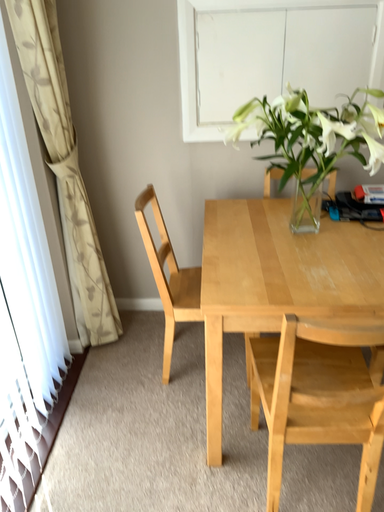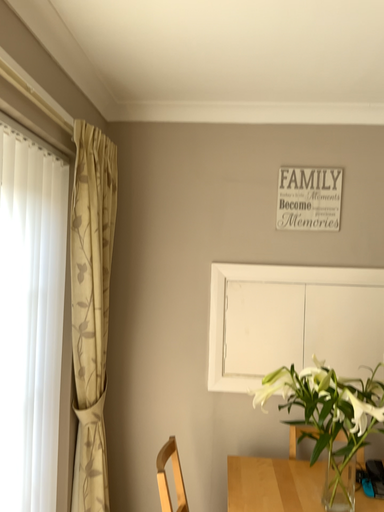
Question: How did the camera likely rotate when shooting the video?

Choices:
 (A) rotated downward
 (B) rotated upward

Answer: (B)